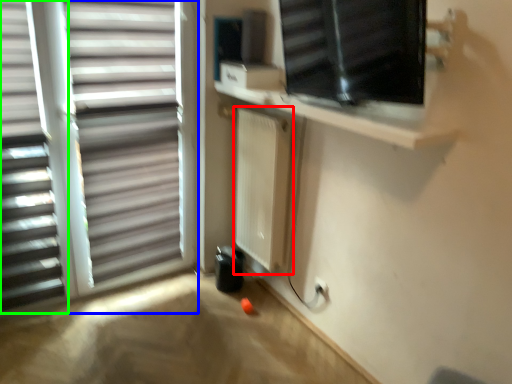
Question: Which is nearer to the radiator (highlighted by a red box)? window (highlighted by a blue box) or window blind (highlighted by a green box).

Choices:
 (A) window
 (B) window blind

Answer: (A)